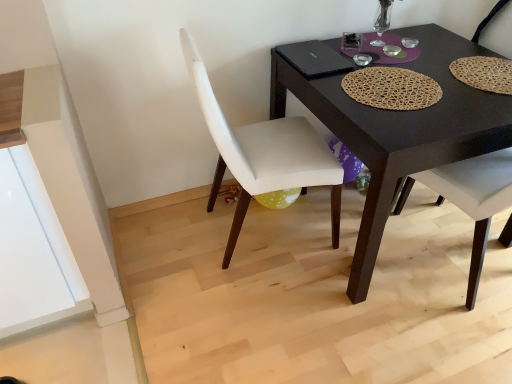
Question: Is white leather chair at center, which is the 1th chair from left to right, further to camera compared to matte white chair at right, which appears as the first chair when viewed from the right?

Choices:
 (A) no
 (B) yes

Answer: (A)

Question: Is white leather chair at center, the second chair positioned from the right, turned away from matte white chair at right, which appears as the first chair when viewed from the right?

Choices:
 (A) yes
 (B) no

Answer: (B)

Question: Is there a large distance between white leather chair at center, which is the 1th chair from left to right, and matte white chair at right, the second chair when ordered from left to right?

Choices:
 (A) yes
 (B) no

Answer: (B)

Question: Is white leather chair at center, which is the 1th chair from left to right, shorter than matte white chair at right, the second chair when ordered from left to right?

Choices:
 (A) yes
 (B) no

Answer: (B)

Question: From a real-world perspective, is white leather chair at center, which is the 1th chair from left to right, beneath matte white chair at right, the second chair when ordered from left to right?

Choices:
 (A) no
 (B) yes

Answer: (A)

Question: Is matte white chair at right, which appears as the first chair when viewed from the right, inside white leather chair at center, which is the 1th chair from left to right?

Choices:
 (A) no
 (B) yes

Answer: (A)

Question: From a real-world perspective, is white leather chair at center, the second chair positioned from the right, located beneath black matte laptop at upper center?

Choices:
 (A) yes
 (B) no

Answer: (A)

Question: From a real-world perspective, is white leather chair at center, the second chair positioned from the right, on top of black matte laptop at upper center?

Choices:
 (A) no
 (B) yes

Answer: (A)

Question: Does white leather chair at center, which is the 1th chair from left to right, have a larger size compared to black matte laptop at upper center?

Choices:
 (A) no
 (B) yes

Answer: (B)

Question: Considering the relative positions of white leather chair at center, which is the 1th chair from left to right, and black matte laptop at upper center in the image provided, is white leather chair at center, which is the 1th chair from left to right, to the left of black matte laptop at upper center from the viewer's perspective?

Choices:
 (A) yes
 (B) no

Answer: (A)

Question: From the image's perspective, is white leather chair at center, the second chair positioned from the right, below black matte laptop at upper center?

Choices:
 (A) no
 (B) yes

Answer: (B)

Question: Can you confirm if white leather chair at center, the second chair positioned from the right, is positioned to the right of black matte laptop at upper center?

Choices:
 (A) no
 (B) yes

Answer: (A)

Question: Can you confirm if black matte laptop at upper center is shorter than matte white chair at right, the second chair when ordered from left to right?

Choices:
 (A) yes
 (B) no

Answer: (A)